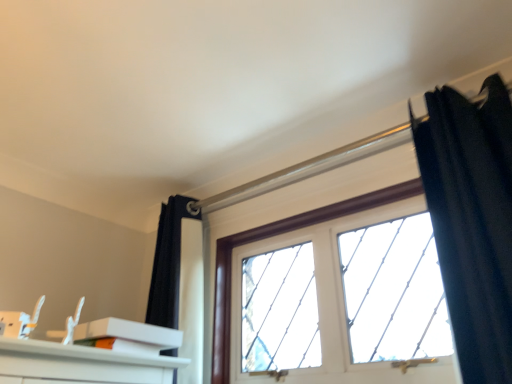
Question: Is black velvet curtain at upper right not near white matte box at lower left?

Choices:
 (A) no
 (B) yes

Answer: (A)

Question: From the image's perspective, is black velvet curtain at upper right located beneath white matte box at lower left?

Choices:
 (A) yes
 (B) no

Answer: (B)

Question: From a real-world perspective, is black velvet curtain at upper right physically above white matte box at lower left?

Choices:
 (A) no
 (B) yes

Answer: (B)

Question: Is black velvet curtain at upper right to the left of white matte box at lower left from the viewer's perspective?

Choices:
 (A) yes
 (B) no

Answer: (B)

Question: Considering the relative sizes of black velvet curtain at upper right and white matte box at lower left in the image provided, is black velvet curtain at upper right shorter than white matte box at lower left?

Choices:
 (A) yes
 (B) no

Answer: (B)

Question: Based on their sizes in the image, would you say black velvet curtain at upper right is bigger or smaller than white matte box at lower left?

Choices:
 (A) big
 (B) small

Answer: (A)

Question: From the image's perspective, is black velvet curtain at upper right above or below white matte box at lower left?

Choices:
 (A) below
 (B) above

Answer: (B)

Question: From a real-world perspective, is black velvet curtain at upper right above or below white matte box at lower left?

Choices:
 (A) above
 (B) below

Answer: (A)

Question: Is black velvet curtain at upper right taller or shorter than white matte box at lower left?

Choices:
 (A) short
 (B) tall

Answer: (B)

Question: From their relative heights in the image, would you say clear glass window at center is taller or shorter than white matte box at lower left?

Choices:
 (A) tall
 (B) short

Answer: (A)

Question: From a real-world perspective, is clear glass window at center positioned above or below white matte box at lower left?

Choices:
 (A) below
 (B) above

Answer: (B)

Question: Is clear glass window at center wider or thinner than white matte box at lower left?

Choices:
 (A) thin
 (B) wide

Answer: (B)

Question: Which is correct: clear glass window at center is inside white matte box at lower left, or outside of it?

Choices:
 (A) inside
 (B) outside

Answer: (B)

Question: Considering their positions, is clear glass window at center located in front of or behind black velvet curtain at upper right?

Choices:
 (A) behind
 (B) front

Answer: (A)

Question: From a real-world perspective, is clear glass window at center above or below black velvet curtain at upper right?

Choices:
 (A) below
 (B) above

Answer: (A)